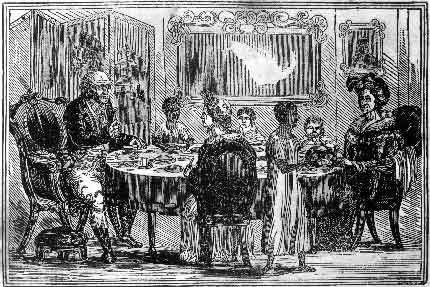
Find the location of a particular element. ottoman is located at coordinates [x=69, y=245].